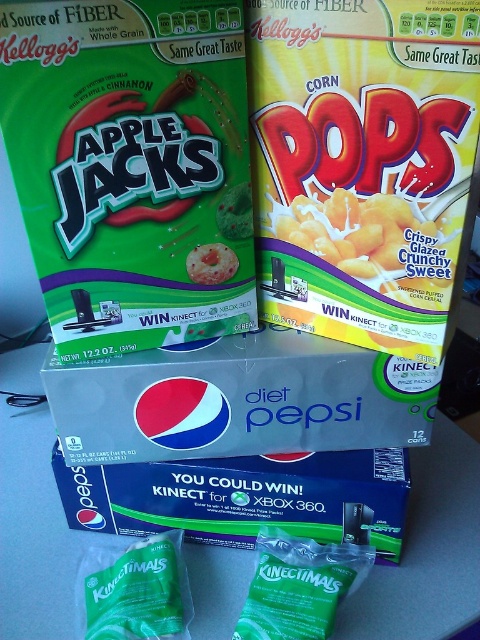
Question: Which point appears farthest from the camera in this image?

Choices:
 (A) (156, 598)
 (B) (192, 269)
 (C) (156, 529)

Answer: (C)

Question: Is green matte kinectimals at center wider than smooth plastic apple at center?

Choices:
 (A) no
 (B) yes

Answer: (B)

Question: Is yellow paper corn pops at upper right closer to the viewer compared to smooth plastic apple at center?

Choices:
 (A) yes
 (B) no

Answer: (A)

Question: Which object appears closest to the camera in this image?

Choices:
 (A) green matte kinectimals at center
 (B) yellow paper corn pops at upper right

Answer: (B)

Question: Estimate the real-world distances between objects in this image. Which object is closer to the blue cardboard pepsi box at center?

Choices:
 (A) yellow paper corn pops at upper right
 (B) green matte kinectimals at center

Answer: (B)

Question: Does yellow paper corn pops at upper right appear on the right side of green matte kinectimals at center?

Choices:
 (A) yes
 (B) no

Answer: (A)